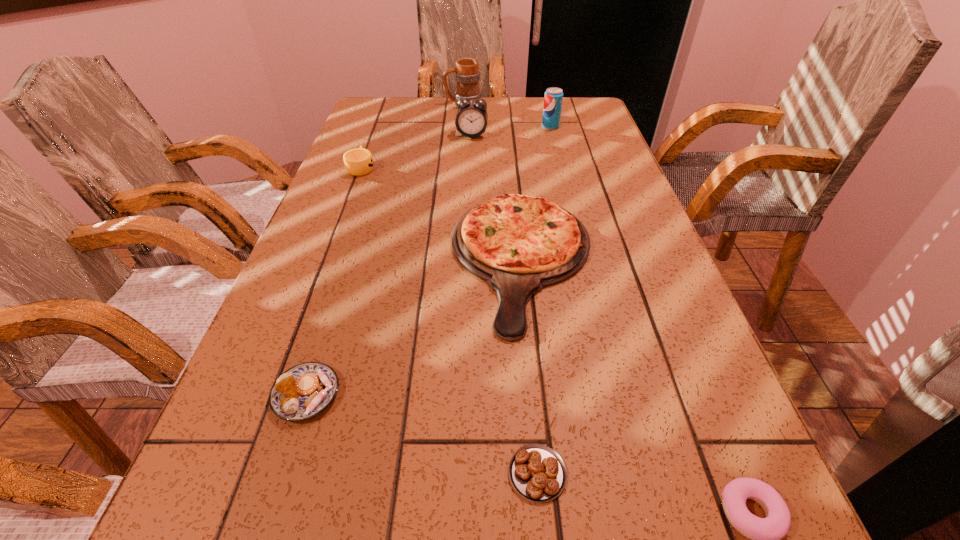
This screenshot has width=960, height=540. I want to click on vacant position located on the side of the mug with the handle, so click(367, 104).

Find the location of a particular element. free space located 0.270m on the side of the mug with the handle is located at coordinates (367, 104).

At what (x,y) coordinates should I click in order to perform the action: click on free space located on the side of the mug with the handle. Please return your answer as a coordinate pair (x, y). The height and width of the screenshot is (540, 960). Looking at the image, I should click on (375, 104).

You are a GUI agent. You are given a task and a screenshot of the screen. Output one action in this format:
    pyautogui.click(x=<x>, y=<y>)
    Task: Click on the free location located on the left of the second farthest object
    The image size is (960, 540).
    Given the screenshot: What is the action you would take?
    pyautogui.click(x=452, y=126)

Where is `free spot located on the front side of the third farthest object`? free spot located on the front side of the third farthest object is located at coordinates (469, 215).

Identify the location of free spot located on the back of the fourth nearest object. (515, 191).

This screenshot has width=960, height=540. Identify the location of vacant region located on the back of the fifth nearest object. pos(375,130).

The height and width of the screenshot is (540, 960). Find the location of `vacant space located 0.070m on the front of the third shortest object`. vacant space located 0.070m on the front of the third shortest object is located at coordinates (282, 471).

Locate an element on the screen. The image size is (960, 540). blank space located on the back of the shortest pastry is located at coordinates (x=518, y=265).

Identify the location of mug positioned at the far edge. (467, 73).